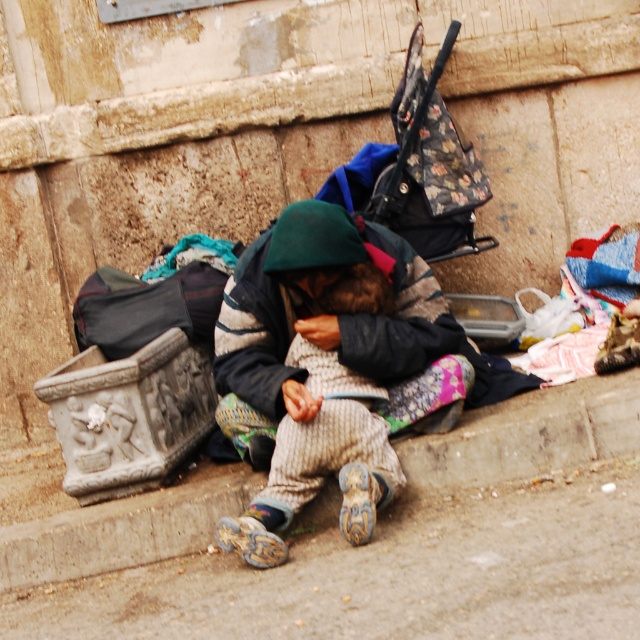
Question: From the image, what is the correct spatial relationship of brown concrete pavement at lower center in relation to knitted woolen sweater at center?

Choices:
 (A) left
 (B) right

Answer: (A)

Question: Is brown concrete pavement at lower center to the right of knitted woolen sweater at center from the viewer's perspective?

Choices:
 (A) yes
 (B) no

Answer: (B)

Question: Can you confirm if brown concrete pavement at lower center is positioned above knitted woolen sweater at center?

Choices:
 (A) no
 (B) yes

Answer: (A)

Question: Which of the following is the closest to the observer?

Choices:
 (A) (355, 264)
 (B) (561, 557)

Answer: (B)